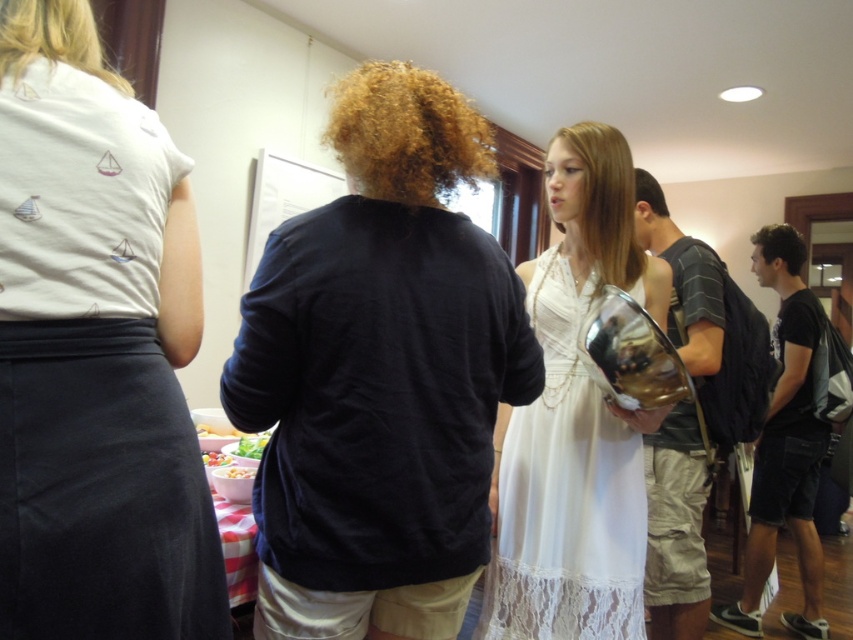
Question: Which point is farther to the camera?

Choices:
 (A) (776, 257)
 (B) (354, 483)
 (C) (587, 122)
 (D) (508, 458)

Answer: (A)

Question: Is blonde hair at upper left closer to camera compared to brown curly hair at upper center?

Choices:
 (A) no
 (B) yes

Answer: (B)

Question: Which object is positioned closest to the dark blue shirt at center?

Choices:
 (A) white lace dress at center
 (B) white cotton shirt at upper left
 (C) blonde hair at upper left

Answer: (B)

Question: Can you confirm if white lace dress at center is thinner than smooth brown hair at center?

Choices:
 (A) yes
 (B) no

Answer: (B)

Question: Which object is the farthest from the smooth brown hair at center?

Choices:
 (A) brown curly hair at upper center
 (B) curly blonde hair at center
 (C) dark blue shirt at center

Answer: (C)

Question: Can you confirm if dark blue shirt at center is wider than brown curly hair at upper center?

Choices:
 (A) yes
 (B) no

Answer: (A)